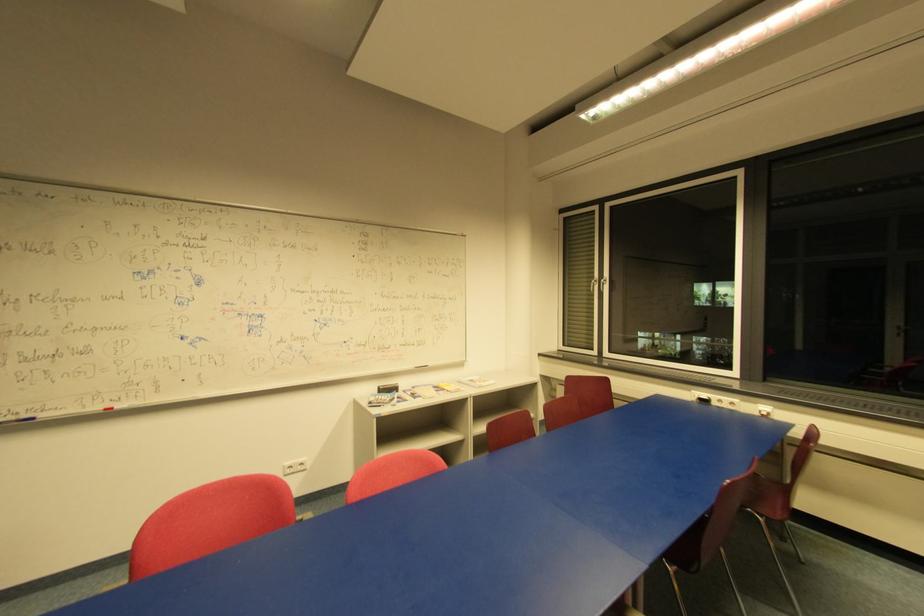
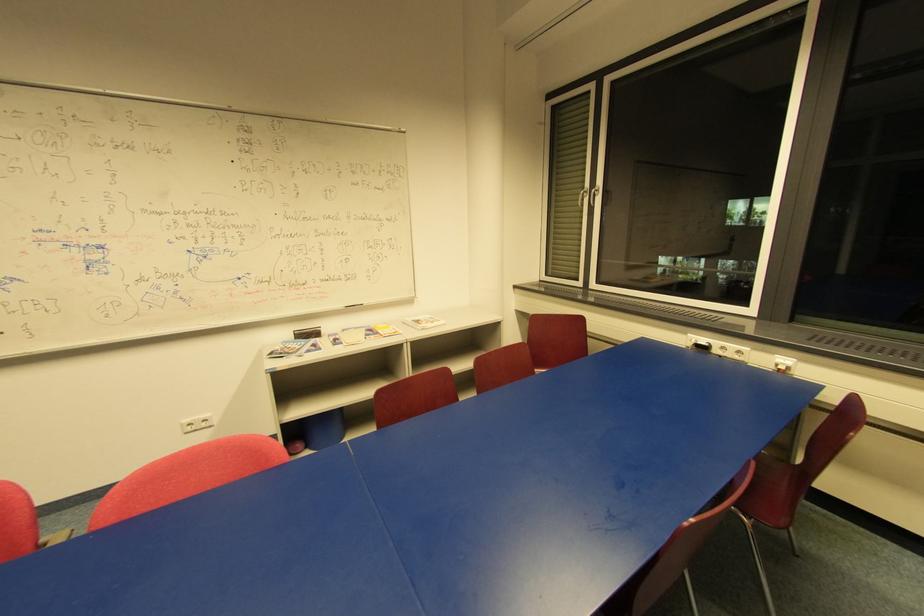
In the second image, find the point that corresponds to the point at 608,282 in the first image.

(598, 192)